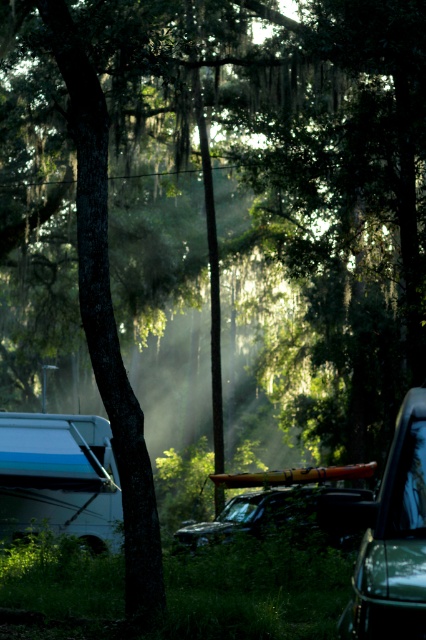
Does metallic green car at right have a greater height compared to shiny black suv at center?

No, metallic green car at right is not taller than shiny black suv at center.

Which is behind, point (376, 573) or point (281, 516)?

Point (281, 516)

You are a GUI agent. You are given a task and a screenshot of the screen. Output one action in this format:
    pyautogui.click(x=<x>, y=<y>)
    Task: Click on the metallic green car at right
    This screenshot has width=426, height=640.
    Given the screenshot: What is the action you would take?
    [x=394, y=540]

Is blue metallic camper at lower left wider than metallic green car at right?

Indeed, blue metallic camper at lower left has a greater width compared to metallic green car at right.

Who is positioned more to the right, blue metallic camper at lower left or metallic green car at right?

From the viewer's perspective, metallic green car at right appears more on the right side.

The image size is (426, 640). Describe the element at coordinates (58, 476) in the screenshot. I see `blue metallic camper at lower left` at that location.

Identify the location of blue metallic camper at lower left. (58, 476).

Between blue metallic camper at lower left and shiny black suv at center, which one appears on the right side from the viewer's perspective?

shiny black suv at center

Is blue metallic camper at lower left taller than shiny black suv at center?

Incorrect, blue metallic camper at lower left's height is not larger of shiny black suv at center's.

Is point (51, 451) more distant than point (314, 522)?

Yes.

Locate an element on the screen. This screenshot has height=640, width=426. blue metallic camper at lower left is located at coordinates (58, 476).